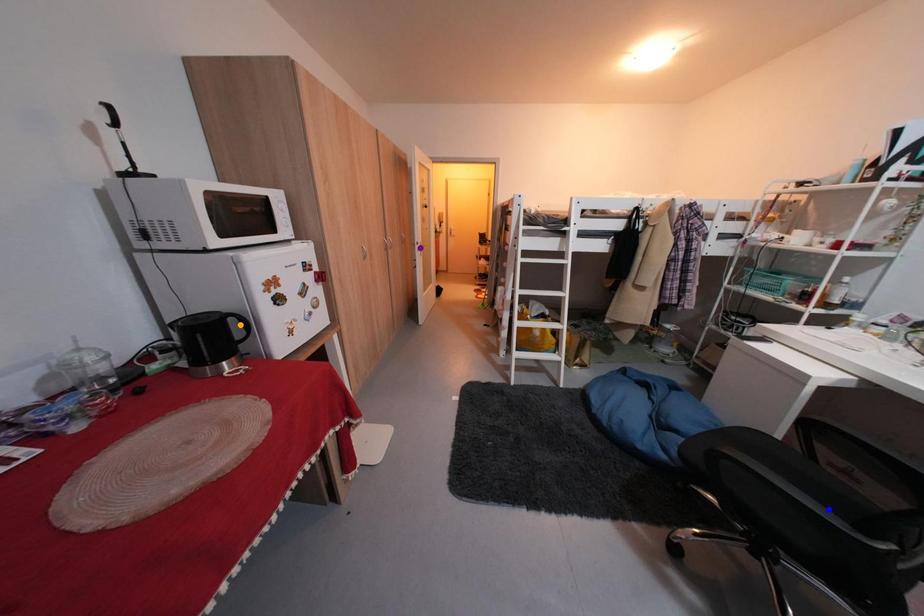
Order these from farthest to nearest:
blue point
purple point
orange point

purple point < orange point < blue point